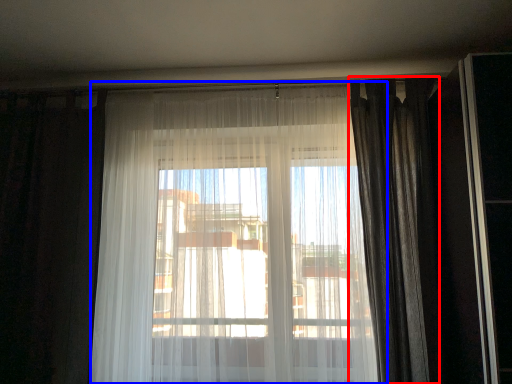
Question: Which point is closer to the camera, curtain (highlighted by a red box) or curtain (highlighted by a blue box)?

Choices:
 (A) curtain
 (B) curtain

Answer: (B)